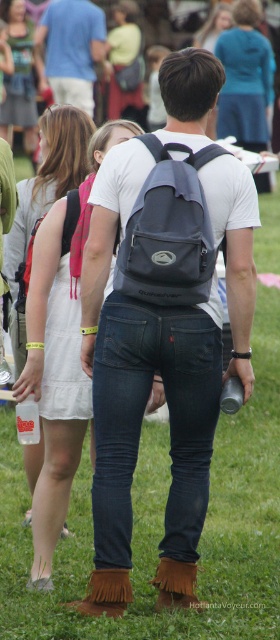
Question: Is blue denim jacket at upper center positioned before matte black backpack at upper center?

Choices:
 (A) no
 (B) yes

Answer: (B)

Question: Can you confirm if white cotton dress at upper left is bigger than blue denim jacket at upper center?

Choices:
 (A) yes
 (B) no

Answer: (B)

Question: Can you confirm if matte black backpack at center is positioned above matte black backpack at upper center?

Choices:
 (A) no
 (B) yes

Answer: (A)

Question: Which point is farther to the camera?

Choices:
 (A) (122, 273)
 (B) (89, 45)

Answer: (B)

Question: Which object appears farthest from the camera in this image?

Choices:
 (A) matte white dress at center
 (B) matte black backpack at center
 (C) white cotton dress at upper left
 (D) matte black backpack at upper center

Answer: (A)

Question: Which object appears closest to the camera in this image?

Choices:
 (A) blue denim jacket at upper center
 (B) matte white dress at center

Answer: (A)